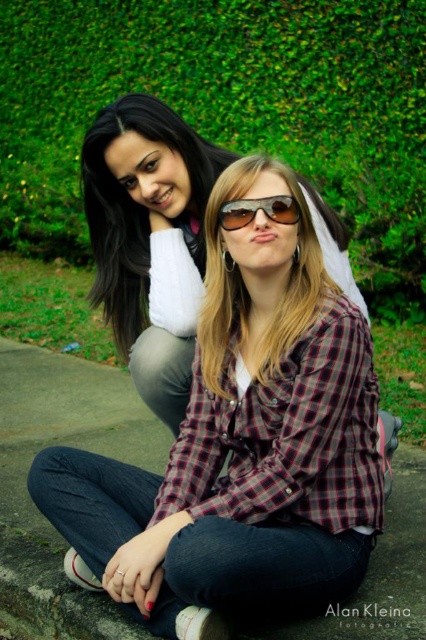
Question: Which object is positioned closest to the sunglasses at center?

Choices:
 (A) plaid fabric shirt at center
 (B) green leafy hedge at upper center
 (C) plaid shirt at center

Answer: (A)

Question: Among these points, which one is farthest from the camera?

Choices:
 (A) (141, 300)
 (B) (227, 221)
 (C) (175, 470)

Answer: (A)

Question: Can you confirm if plaid fabric shirt at center is positioned below sunglasses at center?

Choices:
 (A) yes
 (B) no

Answer: (A)

Question: Can you confirm if plaid shirt at center is positioned below sunglasses at center?

Choices:
 (A) no
 (B) yes

Answer: (B)

Question: Based on their relative distances, which object is farther from the plaid shirt at center?

Choices:
 (A) green leafy hedge at upper center
 (B) plaid fabric shirt at center
 (C) sunglasses at center

Answer: (A)

Question: Considering the relative positions of plaid fabric shirt at center and plaid shirt at center in the image provided, where is plaid fabric shirt at center located with respect to plaid shirt at center?

Choices:
 (A) left
 (B) right

Answer: (B)